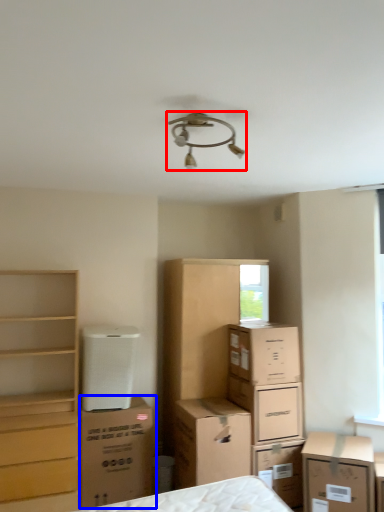
Question: Which object appears closest to the camera in this image, lamp (highlighted by a red box) or cardboard box (highlighted by a blue box)?

Choices:
 (A) lamp
 (B) cardboard box

Answer: (A)